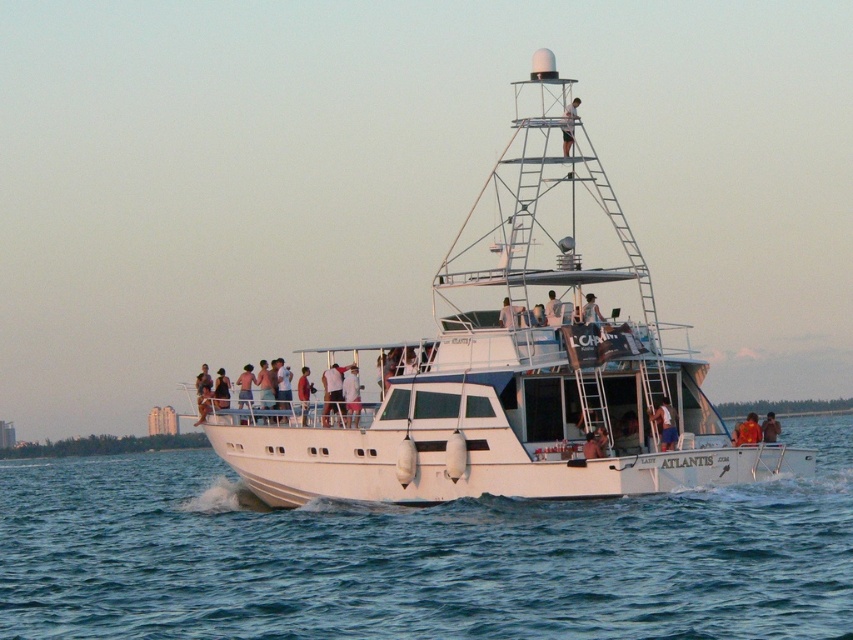
What do you see at coordinates (332, 392) in the screenshot? I see `matte white shirt at center` at bounding box center [332, 392].

Does matte white shirt at center appear on the left side of red fabric shirt at center?

No, matte white shirt at center is not to the left of red fabric shirt at center.

Which is in front, point (334, 394) or point (302, 376)?

Positioned in front is point (334, 394).

The image size is (853, 640). Find the location of `matte white shirt at center`. matte white shirt at center is located at coordinates [x=332, y=392].

Find the location of `matte white shirt at center`. matte white shirt at center is located at coordinates (332, 392).

Does matte white shirt at center have a larger size compared to white matte shirt at upper center?

Yes, matte white shirt at center is bigger than white matte shirt at upper center.

Identify the location of matte white shirt at center. (332, 392).

Which is more to the left, red fabric shirt at center or white fabric shirt at center?

Positioned to the left is red fabric shirt at center.

Does red fabric shirt at center have a greater width compared to white fabric shirt at center?

Indeed, red fabric shirt at center has a greater width compared to white fabric shirt at center.

I want to click on red fabric shirt at center, so click(305, 392).